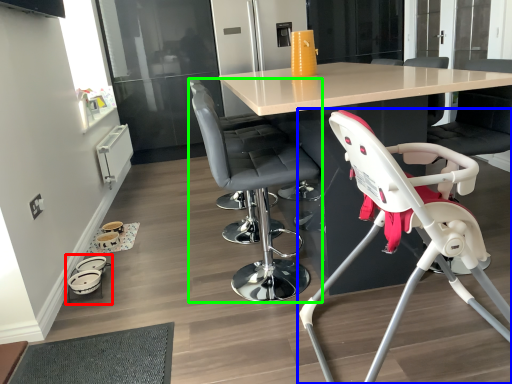
Question: Based on their relative distances, which object is nearer to baby carriage (highlighted by a red box)? Choose from chair (highlighted by a blue box) and chair (highlighted by a green box).

Choices:
 (A) chair
 (B) chair

Answer: (B)